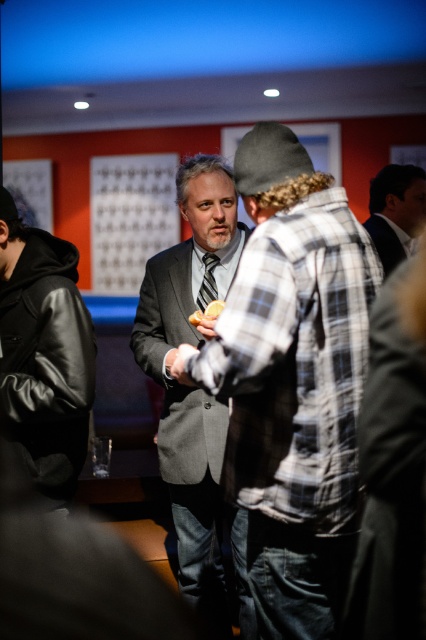
Question: Which of the following is the closest to the observer?

Choices:
 (A) plaid flannel shirt at center
 (B) dark gray suit at center
 (C) dark gray suit at upper right

Answer: (A)

Question: Is dark gray suit at upper right above dark gray suit at center?

Choices:
 (A) no
 (B) yes

Answer: (B)

Question: Can you confirm if black leather jacket at left is positioned below dark gray suit at center?

Choices:
 (A) yes
 (B) no

Answer: (A)

Question: Is plaid flannel shirt at center smaller than gray suit at center?

Choices:
 (A) no
 (B) yes

Answer: (B)

Question: Which of the following is the closest to the observer?

Choices:
 (A) black leather jacket at left
 (B) gray suit at center
 (C) dark gray suit at upper right
 (D) plaid flannel shirt at center

Answer: (D)

Question: Which point is closer to the camera?

Choices:
 (A) (397, 193)
 (B) (330, 573)
 (C) (218, 476)

Answer: (B)